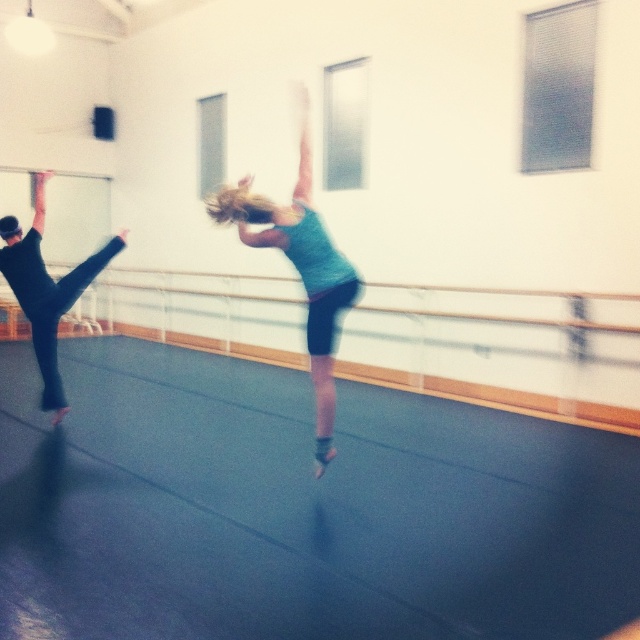
Question: Is teal fabric ballerina at center to the left of black matte leggings at left from the viewer's perspective?

Choices:
 (A) yes
 (B) no

Answer: (B)

Question: Does teal fabric ballerina at center appear under black matte leggings at left?

Choices:
 (A) no
 (B) yes

Answer: (A)

Question: Which point is farther to the camera?

Choices:
 (A) teal fabric ballerina at center
 (B) black matte leggings at left

Answer: (B)

Question: Is teal fabric ballerina at center smaller than black matte leggings at left?

Choices:
 (A) no
 (B) yes

Answer: (A)

Question: Among these points, which one is nearest to the camera?

Choices:
 (A) (83, 262)
 (B) (216, 196)

Answer: (B)